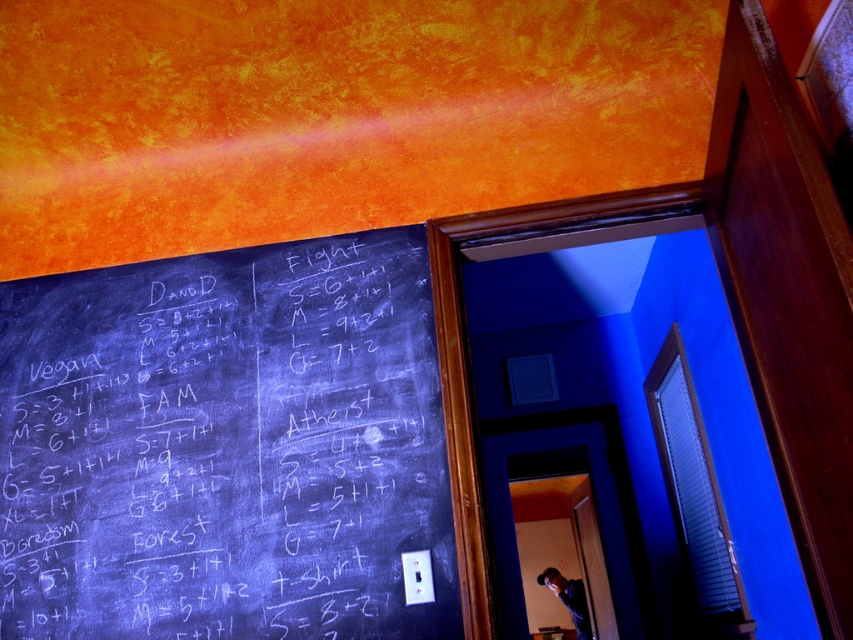
In the scene shown: Between black chalkboard at left and matte black shirt at center, which one appears on the left side from the viewer's perspective?

black chalkboard at left

Is point (277, 451) farther from camera compared to point (553, 582)?

No, (277, 451) is in front of (553, 582).

Which is behind, point (366, 397) or point (556, 582)?

The point (556, 582) is behind.

Find the location of a particular element. This screenshot has height=640, width=853. black chalkboard at left is located at coordinates (227, 448).